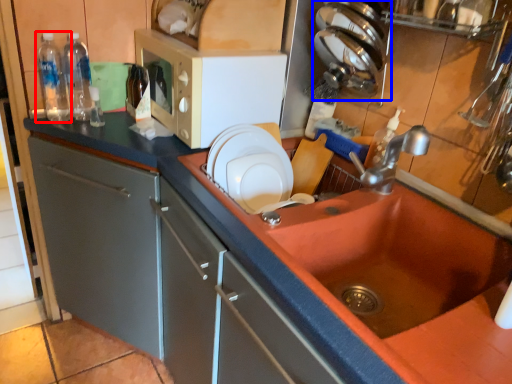
Question: Among these objects, which one is nearest to the camera, bottle (highlighted by a red box) or appliance (highlighted by a blue box)?

Choices:
 (A) bottle
 (B) appliance

Answer: (B)